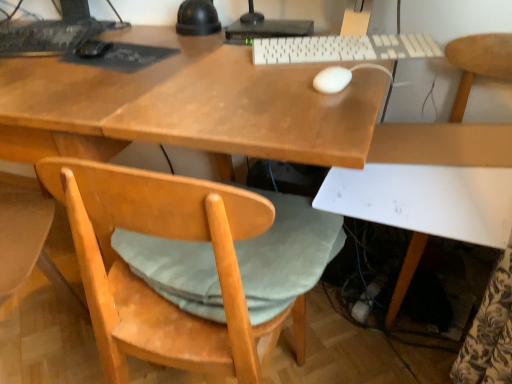
The height and width of the screenshot is (384, 512). I want to click on free point above dark gray matte mousepad at upper left (from a real-world perspective), so click(x=95, y=46).